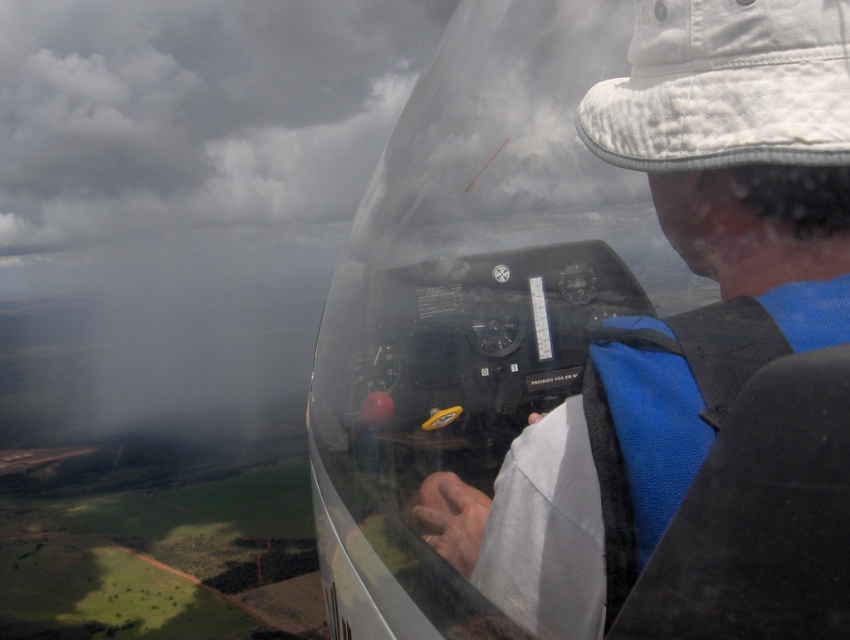
Question: Estimate the real-world distances between objects in this image. Which object is closer to the cloudy gray sky at upper left?

Choices:
 (A) white quilted fabric baseball hat at upper center
 (B) transparent plastic cockpit at center

Answer: (A)

Question: Among these points, which one is farthest from the camera?

Choices:
 (A) (102, 227)
 (B) (843, 36)
 (C) (772, 291)

Answer: (A)

Question: Based on their relative distances, which object is farther from the cloudy gray sky at upper left?

Choices:
 (A) white quilted fabric baseball hat at upper center
 (B) transparent plastic cockpit at center

Answer: (B)

Question: Does cloudy gray sky at upper left have a larger size compared to white quilted fabric baseball hat at upper center?

Choices:
 (A) no
 (B) yes

Answer: (B)

Question: Is cloudy gray sky at upper left further to camera compared to white quilted fabric baseball hat at upper center?

Choices:
 (A) no
 (B) yes

Answer: (B)

Question: Does cloudy gray sky at upper left appear on the right side of white quilted fabric baseball hat at upper center?

Choices:
 (A) no
 (B) yes

Answer: (A)